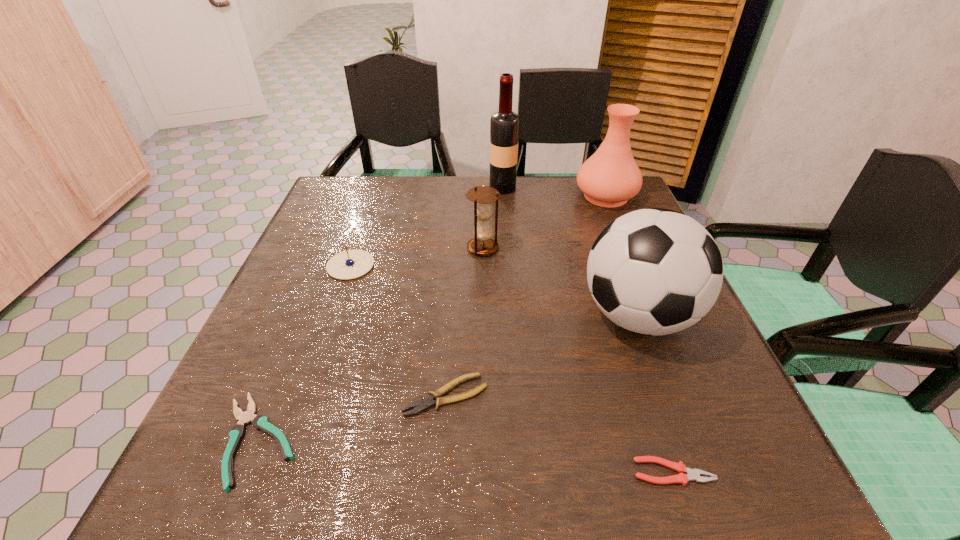
Find the location of a particular element. This screenshot has width=960, height=540. free space at the far left corner of the desktop is located at coordinates (334, 206).

I want to click on vacant area that lies between the hourglass and the wine bottle, so [492, 218].

The width and height of the screenshot is (960, 540). I want to click on empty space between the fourth tallest object and the fifth tallest object, so click(x=417, y=256).

Where is `empty location between the soccer ball and the rightmost pliers`? empty location between the soccer ball and the rightmost pliers is located at coordinates (656, 394).

Locate an element on the screen. vacant area that lies between the tallest object and the vase is located at coordinates (554, 192).

This screenshot has width=960, height=540. Find the location of `free space between the rightmost pliers and the tallest object`. free space between the rightmost pliers and the tallest object is located at coordinates (588, 330).

Where is `free area in between the second pliers from right to left and the rightmost pliers`? free area in between the second pliers from right to left and the rightmost pliers is located at coordinates (560, 434).

Identify the location of unoccupied area between the compass and the rightmost pliers. The image size is (960, 540). (512, 369).

Find the location of a particular element. free space between the leftmost pliers and the tallest object is located at coordinates (380, 314).

Where is `empty space between the fifth tallest object and the rightmost pliers`? empty space between the fifth tallest object and the rightmost pliers is located at coordinates (512, 369).